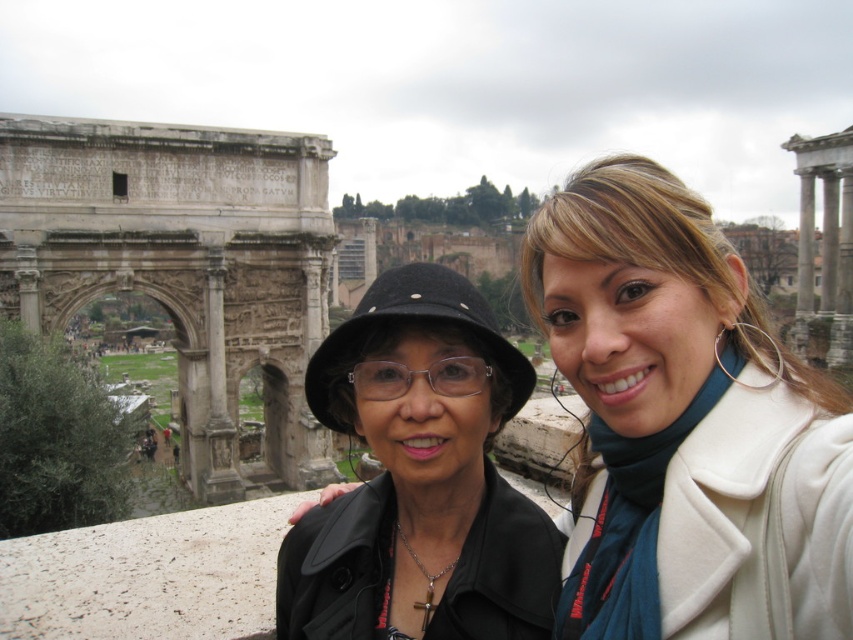
Question: Can you confirm if matte black hat at center is positioned to the right of black matte hat at center?

Choices:
 (A) no
 (B) yes

Answer: (B)

Question: Which point appears closest to the camera in this image?

Choices:
 (A) (610, 484)
 (B) (463, 532)

Answer: (A)

Question: Which point is closer to the camera?

Choices:
 (A) matte black hat at center
 (B) black matte hat at center

Answer: (A)

Question: Does matte black hat at center have a greater width compared to black matte hat at center?

Choices:
 (A) no
 (B) yes

Answer: (B)

Question: Can you confirm if matte black hat at center is wider than black matte hat at center?

Choices:
 (A) no
 (B) yes

Answer: (B)

Question: Which object appears closest to the camera in this image?

Choices:
 (A) matte black hat at center
 (B) black matte hat at center

Answer: (A)